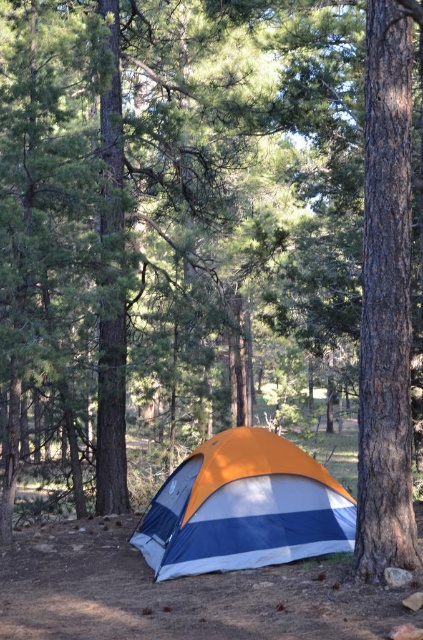
Does smooth brown tree trunk at right have a greater height compared to orange/white striped tent at center?

Indeed, smooth brown tree trunk at right has a greater height compared to orange/white striped tent at center.

Locate an element on the screen. The height and width of the screenshot is (640, 423). smooth brown tree trunk at right is located at coordinates (386, 301).